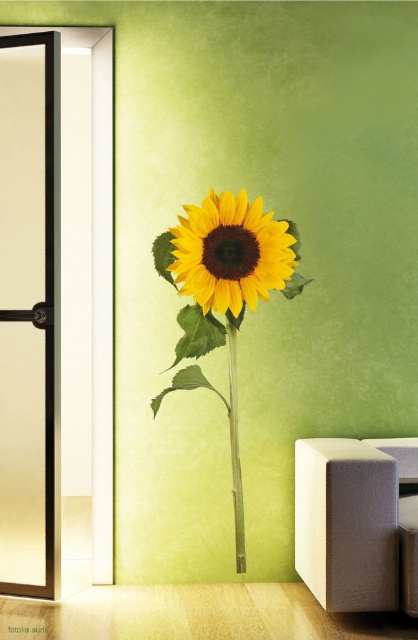
You are an interior designer planning to hang a new shelf above the yellow matte sunflower at center and the green bamboo stem at center. Which object should the shelf be placed higher than to ensure it doesn

The shelf should be placed higher than the green bamboo stem at center because the yellow matte sunflower at center is not as tall as the green bamboo stem at center, so the bamboo stem is taller and requires more clearance.

You are standing in the modern interior space with the vibrant green wall. You want to place a new decorative item exactly at the point marked by the coordinates point (231,252). What object is already at that location?

The yellow matte sunflower at center is located at point (231,252).

You are standing in the room and want to place a new decorative item exactly at the center of the room. The current yellow matte sunflower at center is already placed at point 0.395, 0.553. Can you determine if the new item will be placed directly in the center of the room?

The yellow matte sunflower at center is positioned at point (231, 252), which is not the exact center of the room. The center of the room would be at point (209, 320). Therefore, placing the new item at the center would require moving it slightly to the right and up from the current position of the yellow matte sunflower at center.